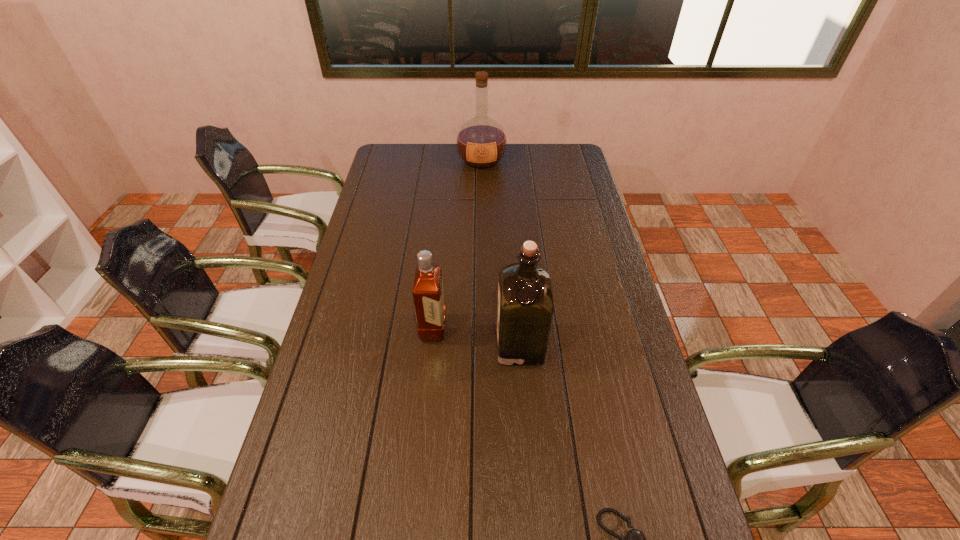
Image resolution: width=960 pixels, height=540 pixels. I want to click on the farthest object, so click(481, 142).

Image resolution: width=960 pixels, height=540 pixels. I want to click on the shortest liquor, so click(x=428, y=296).

Find the location of a particular element. This screenshot has height=540, width=960. free space located on the front label of the farthest object is located at coordinates 482,211.

I want to click on free spot located 0.360m on the front label of the second shortest object, so click(564, 328).

Identify the location of object at the far edge. (481, 142).

In the image, there is a desktop. In order to click on vacant space at the left edge in this screenshot , I will do `click(335, 445)`.

I want to click on free space at the right edge of the desktop, so click(592, 252).

You are a GUI agent. You are given a task and a screenshot of the screen. Output one action in this format:
    pyautogui.click(x=<x>, y=<y>)
    Task: Click on the free space at the far right corner
    The height and width of the screenshot is (540, 960).
    Given the screenshot: What is the action you would take?
    pyautogui.click(x=560, y=154)

This screenshot has width=960, height=540. In order to click on free point between the shortest liquor and the farthest object in this screenshot , I will do `click(457, 245)`.

Find the location of a particular element. vacant space that's between the shortest liquor and the farthest liquor is located at coordinates (457, 245).